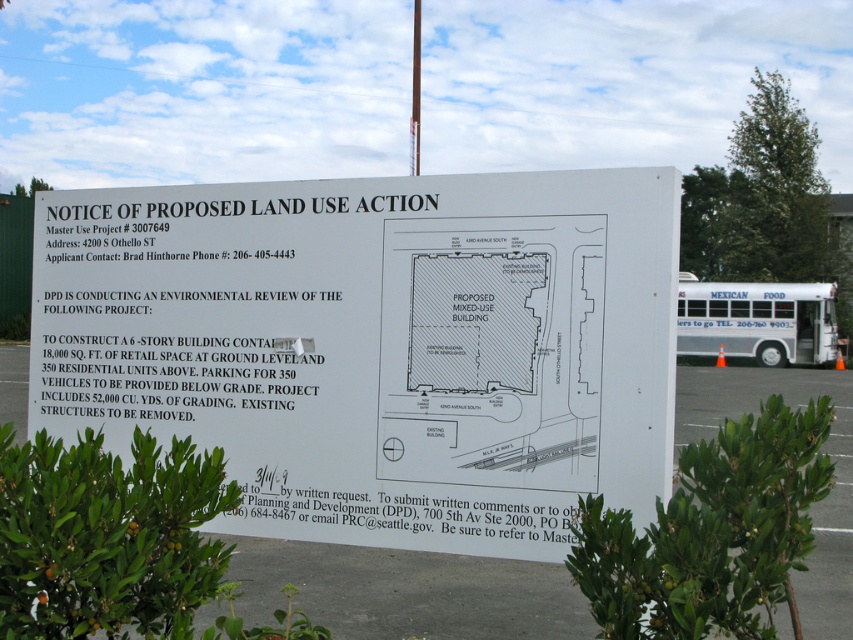
Which is more to the right, white paper sign at center or white metallic bus at center?

white metallic bus at center

Which is in front, point (633, 403) or point (816, 333)?

Positioned in front is point (633, 403).

What do you see at coordinates (375, 346) in the screenshot? I see `white paper sign at center` at bounding box center [375, 346].

This screenshot has width=853, height=640. I want to click on white paper sign at center, so click(x=375, y=346).

Is white paper sign at center thinner than white concrete parking lot at center?

Yes.

Is white paper sign at center positioned in front of white concrete parking lot at center?

Yes, it is.

Between point (306, 364) and point (399, 620), which one is positioned in front?

Point (306, 364)

Identify the location of white paper sign at center. This screenshot has width=853, height=640. click(375, 346).

From the picture: Who is positioned more to the left, white concrete parking lot at center or white metallic bus at center?

white concrete parking lot at center is more to the left.

This screenshot has width=853, height=640. Describe the element at coordinates (407, 592) in the screenshot. I see `white concrete parking lot at center` at that location.

The image size is (853, 640). I want to click on white concrete parking lot at center, so click(407, 592).